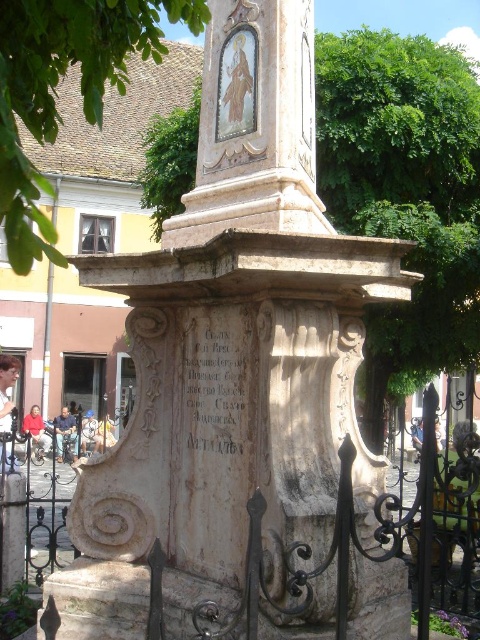
Question: Does green leafy tree at upper center come behind stone inscription at center?

Choices:
 (A) no
 (B) yes

Answer: (B)

Question: Can you confirm if green leafy tree at upper left is positioned below stone inscription at center?

Choices:
 (A) no
 (B) yes

Answer: (A)

Question: Which point is closer to the camera?

Choices:
 (A) (406, 369)
 (B) (204, 435)

Answer: (B)

Question: Which point appears closest to the camera in this image?

Choices:
 (A) (17, 104)
 (B) (386, 340)
 (C) (243, 380)

Answer: (A)

Question: Which object appears closest to the camera in this image?

Choices:
 (A) green leafy tree at upper center
 (B) green leafy tree at upper left

Answer: (B)

Question: Does green leafy tree at upper left appear on the right side of stone inscription at center?

Choices:
 (A) yes
 (B) no

Answer: (B)